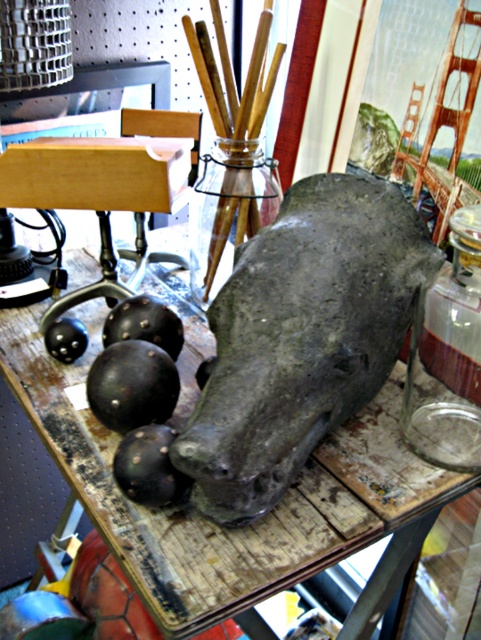
Does rusty wood table at center have a greater height compared to transparent glass jar at center?

Yes.

Between rusty wood table at center and transparent glass jar at center, which one appears on the left side from the viewer's perspective?

rusty wood table at center is more to the left.

Is point (167, 541) positioned in front of point (257, 188)?

Yes, point (167, 541) is in front of point (257, 188).

The height and width of the screenshot is (640, 481). I want to click on rusty wood table at center, so (226, 528).

Between matte gray stone pig at center and transparent glass jar at center, which one is positioned higher?

Positioned higher is transparent glass jar at center.

Does matte gray stone pig at center come in front of transparent glass jar at center?

Yes, matte gray stone pig at center is closer to the viewer.

What do you see at coordinates (302, 337) in the screenshot? I see `matte gray stone pig at center` at bounding box center [302, 337].

I want to click on matte gray stone pig at center, so click(x=302, y=337).

Is point (314, 314) more distant than point (473, 225)?

No, it is in front of (473, 225).

Who is positioned more to the right, matte gray stone pig at center or transparent glass bottle at right?

transparent glass bottle at right is more to the right.

Is point (241, 390) closer to viewer compared to point (435, 344)?

Yes, point (241, 390) is closer to viewer.

At what (x,y) coordinates should I click in order to perform the action: click on matte gray stone pig at center. Please return your answer as a coordinate pair (x, y). The width and height of the screenshot is (481, 640). Looking at the image, I should click on (302, 337).